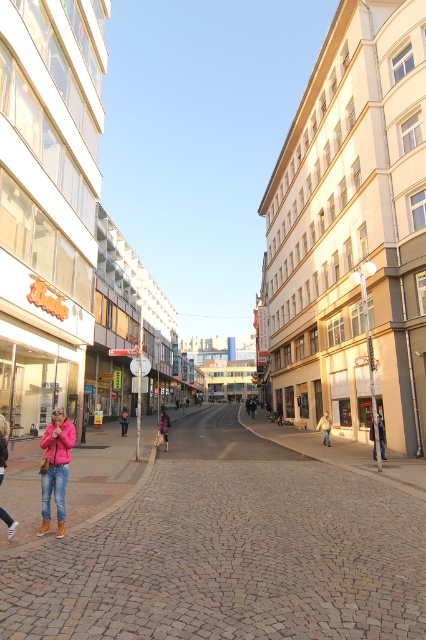
Is point (57, 524) farther from viewer compared to point (120, 417)?

No.

Who is taller, matte pink jacket at lower left or pink fabric bag at center?

pink fabric bag at center is taller.

Is point (54, 476) more distant than point (126, 422)?

No, (54, 476) is closer to viewer.

In order to click on matte pink jacket at lower left in this screenshot , I will do `click(55, 467)`.

Does beige brick building at right have a larger size compared to denim jacket at lower right?

Yes, beige brick building at right is bigger than denim jacket at lower right.

Identify the location of beige brick building at right. This screenshot has height=640, width=426. (353, 228).

Where is `beige brick building at right`? beige brick building at right is located at coordinates (353, 228).

Which is below, pink fabric jacket at lower left or pink fabric coat at center?

pink fabric coat at center is below.

Does pink fabric jacket at lower left have a smaller size compared to pink fabric coat at center?

Indeed, pink fabric jacket at lower left has a smaller size compared to pink fabric coat at center.

Does point (0, 429) lie behind point (164, 428)?

No.

The image size is (426, 640). In order to click on pink fabric jacket at lower left in this screenshot , I will do `click(2, 444)`.